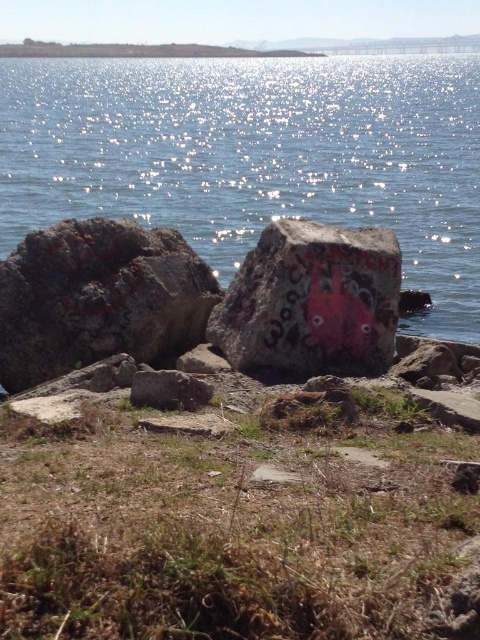
Question: Does smooth concrete boulder at center lie behind smooth gray rock at center?

Choices:
 (A) no
 (B) yes

Answer: (B)

Question: Considering the real-world distances, which object is closest to the smooth concrete boulder at center?

Choices:
 (A) smooth gray rock at center
 (B) rusty rock at left
 (C) glistening water at center

Answer: (B)

Question: Is glistening water at center above smooth concrete boulder at center?

Choices:
 (A) yes
 (B) no

Answer: (A)

Question: Which is farther from the rusty rock at left?

Choices:
 (A) glistening water at center
 (B) smooth gray rock at center

Answer: (A)

Question: Is rusty rock at left closer to the viewer compared to smooth gray rock at center?

Choices:
 (A) no
 (B) yes

Answer: (A)

Question: Which of the following is the closest to the observer?

Choices:
 (A) smooth concrete boulder at center
 (B) glistening water at center
 (C) smooth gray rock at center

Answer: (C)